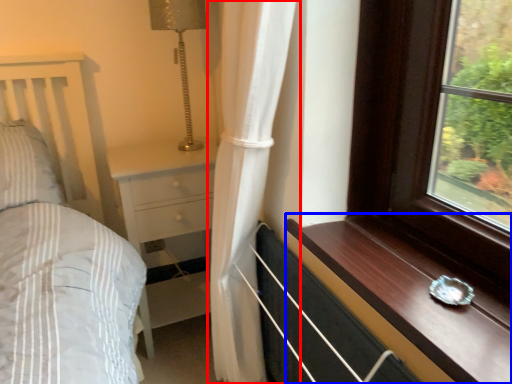
Question: Among these objects, which one is farthest to the camera, curtain (highlighted by a red box) or window sill (highlighted by a blue box)?

Choices:
 (A) curtain
 (B) window sill

Answer: (A)